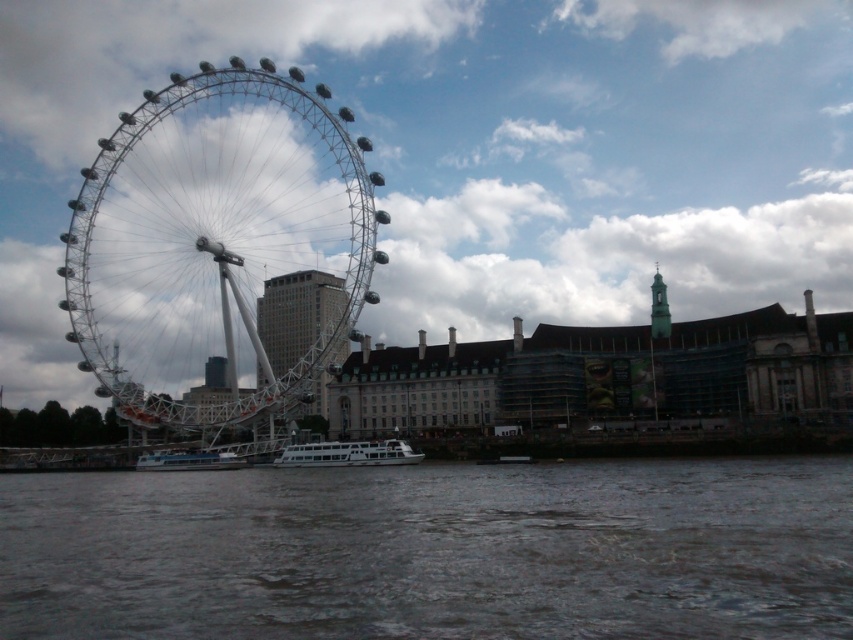
Based on the photo, you are standing at the base of the London Eye and looking towards the Ferris wheel. There are two points marked on the Ferris wheel structure. One is at coordinate point (827, 525) and the other is at point (653, 278). Which point is closer to your current position?

Point (827, 525) is closer to the camera than point (653, 278), so the point at coordinate (827, 525) is closer to your current position.

You are a tourist visiting London and want to take a photo of both the dark gray water at lower center and the green matte tower at upper right. Which object will occupy more space in your photo?

The dark gray water at lower center is larger in size than the green matte tower at upper right, so it will occupy more space in the photo.